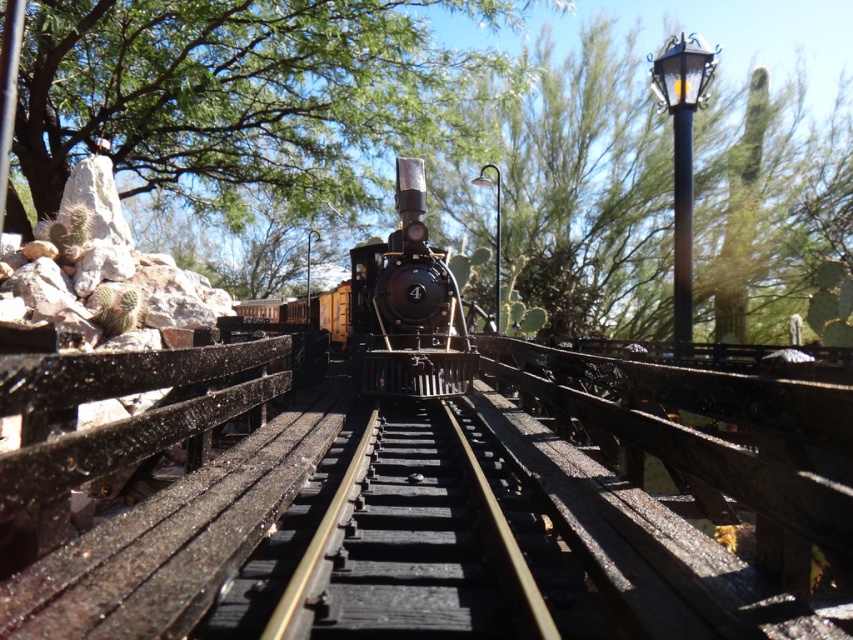
Can you confirm if black metal train track at center is positioned below shiny black locomotive at center?

Indeed, black metal train track at center is positioned under shiny black locomotive at center.

Does black metal train track at center have a greater width compared to shiny black locomotive at center?

Incorrect, black metal train track at center's width does not surpass shiny black locomotive at center's.

Is point (523, 577) farther from viewer compared to point (474, 358)?

No, it is in front of (474, 358).

This screenshot has width=853, height=640. In order to click on black metal train track at center in this screenshot , I will do `click(412, 545)`.

Find the location of `green leafy tree at upper center`. green leafy tree at upper center is located at coordinates (236, 93).

Is the position of green leafy tree at upper center less distant than that of black metal train track at center?

No, green leafy tree at upper center is further to the viewer.

Locate an element on the screen. green leafy tree at upper center is located at coordinates (236, 93).

Is green leafy tree at upper center positioned behind shiny black locomotive at center?

No.

Does point (155, 120) come farther from viewer compared to point (367, 344)?

Yes, point (155, 120) is farther from viewer.

Who is more forward, (65, 67) or (370, 339)?

Point (370, 339) is more forward.

Find the location of a particular element. The height and width of the screenshot is (640, 853). green leafy tree at upper center is located at coordinates (236, 93).